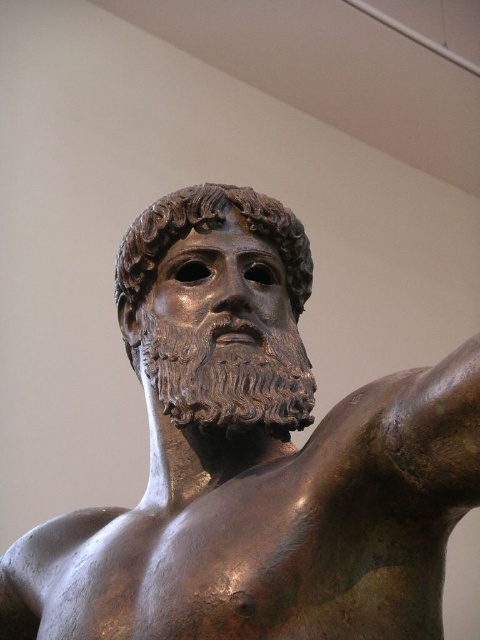
Can you confirm if bronze statue at center is thinner than bronze mask at center?

Yes, bronze statue at center is thinner than bronze mask at center.

Is point (197, 337) positioned in front of point (240, 353)?

No, it is not.

Is point (330, 563) positioned before point (192, 200)?

Yes, point (330, 563) is in front of point (192, 200).

Where is `bronze statue at center`? This screenshot has width=480, height=640. bronze statue at center is located at coordinates (253, 460).